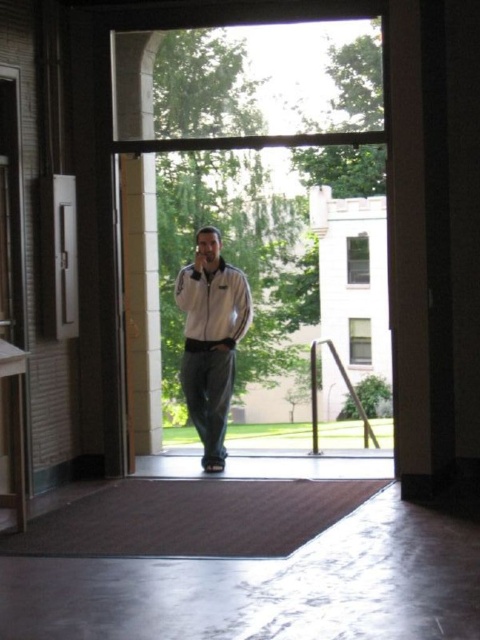
Question: Which point is closer to the camera?

Choices:
 (A) (344, 134)
 (B) (196, 320)

Answer: (A)

Question: Among these objects, which one is farthest from the camera?

Choices:
 (A) white matte jacket at center
 (B) transparent glass door at center

Answer: (A)

Question: Can you confirm if transparent glass door at center is thinner than metallic silver door at left?

Choices:
 (A) yes
 (B) no

Answer: (B)

Question: Which is farther from the white matte jacket at center?

Choices:
 (A) metallic silver door at left
 (B) transparent glass door at center

Answer: (B)

Question: Is the position of transparent glass door at center more distant than that of white matte jacket at center?

Choices:
 (A) no
 (B) yes

Answer: (A)

Question: Is transparent glass door at center thinner than metallic silver door at left?

Choices:
 (A) yes
 (B) no

Answer: (B)